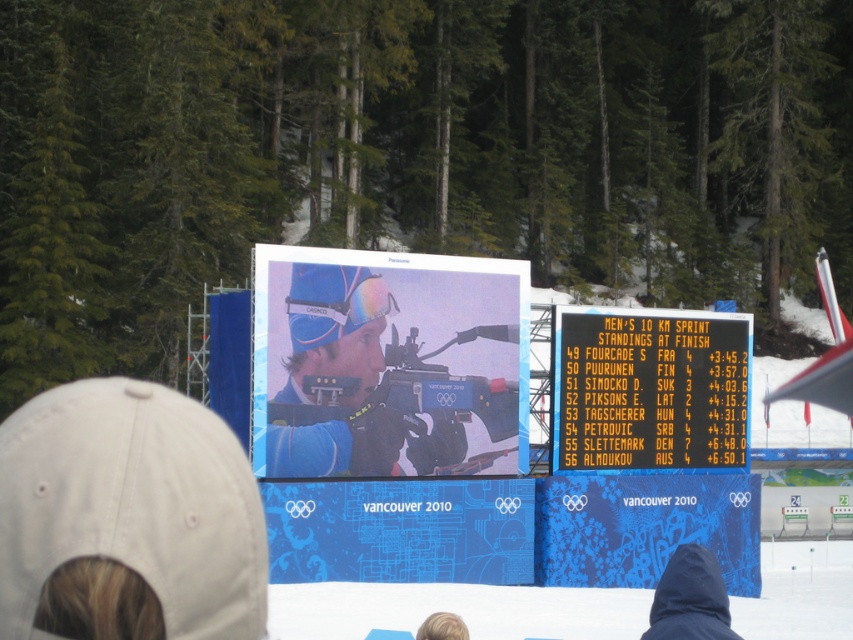
You are a photographer at the Winter Olympics venue. You need to capture a photo of the white fabric baseball cap at lower left and the blue matte rifle at center. Which object should you zoom in more on to ensure both are clearly visible in the frame?

The white fabric baseball cap at lower left is wider than the blue matte rifle at center, so you should zoom in more on the white fabric baseball cap at lower left to ensure both objects are clearly visible in the frame.

You are a photographer positioned at the origin point of the coordinate system in the image. You want to capture a photo of the white fabric baseball cap at lower left. What are the coordinates of the cap to frame it properly?

The coordinates of the white fabric baseball cap at lower left are at point [126,516].

You are a spectator at the Vancouver 2010 Winter Olympics watching the Men 10 km Sprint Biathlon. You notice the white fabric baseball cap at lower left and the blue matte rifle at center. Which object is taller?

The blue matte rifle at center is taller than the white fabric baseball cap at lower left.